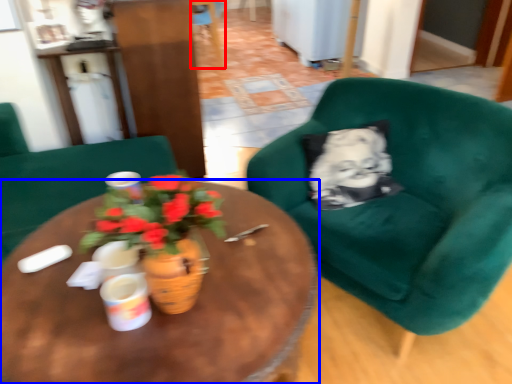
Question: Among these objects, which one is nearest to the camera, chair (highlighted by a red box) or coffee table (highlighted by a blue box)?

Choices:
 (A) chair
 (B) coffee table

Answer: (B)